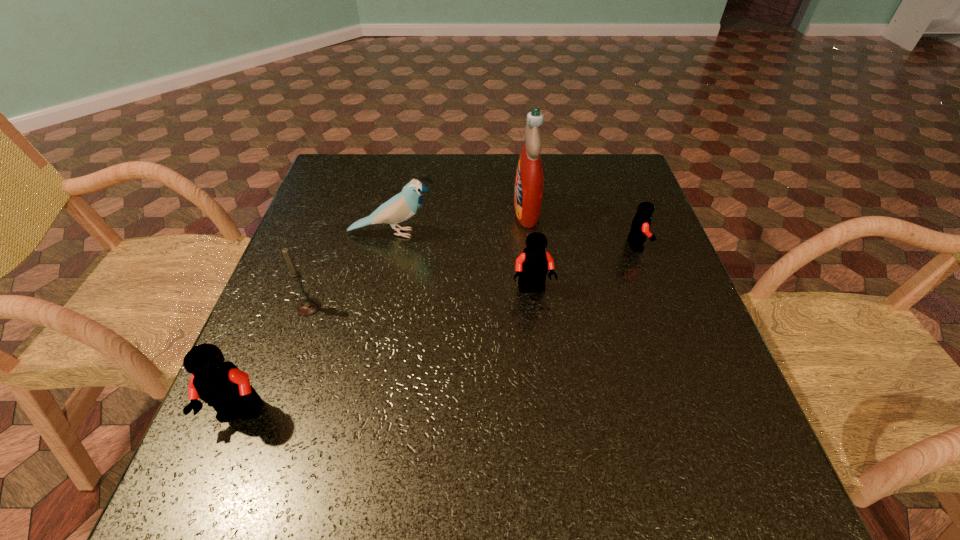
The width and height of the screenshot is (960, 540). Find the location of `Lego that is the third nearest to the candle`. Lego that is the third nearest to the candle is located at coordinates (640, 226).

Where is `Lego that is the closest to the candle`? The height and width of the screenshot is (540, 960). Lego that is the closest to the candle is located at coordinates (219, 383).

Where is `vacant region that satisfies the following two spatial constraints: 1. on the front-facing side of the shortest Lego; 2. on the front-facing side of the second Lego from left to right`? The image size is (960, 540). vacant region that satisfies the following two spatial constraints: 1. on the front-facing side of the shortest Lego; 2. on the front-facing side of the second Lego from left to right is located at coordinates (654, 289).

Find the location of a particular element. blank area in the image that satisfies the following two spatial constraints: 1. on the front-facing side of the farthest Lego; 2. on the front-facing side of the nearest object is located at coordinates (700, 414).